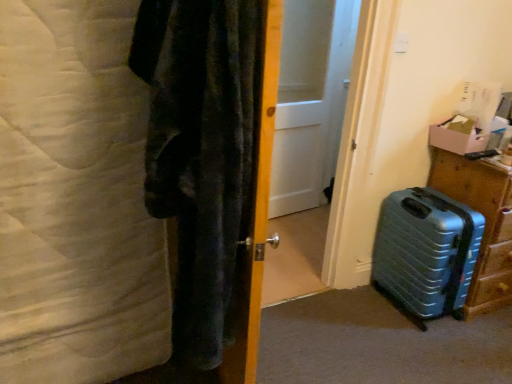
Identify the location of vacant space positioned to the left of metallic blue suitcase at lower right. (362, 311).